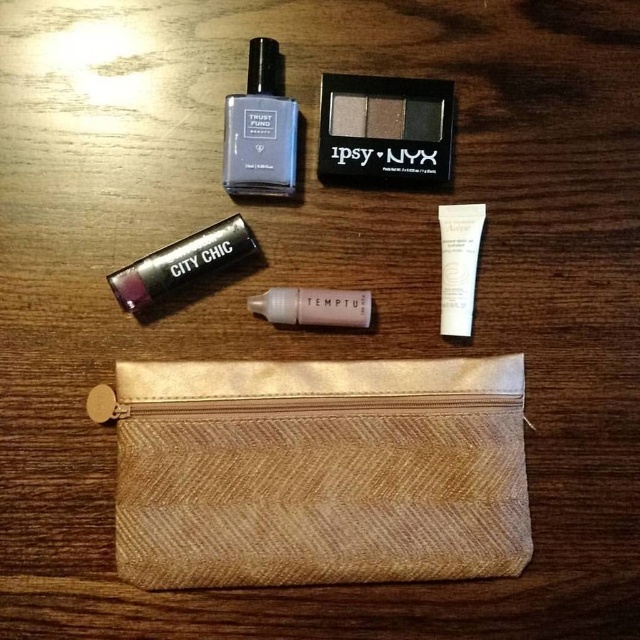
Is gold textured pouch at center smaller than matte eyeshadow palette at upper center?

Incorrect, gold textured pouch at center is not smaller in size than matte eyeshadow palette at upper center.

Measure the distance between gold textured pouch at center and matte eyeshadow palette at upper center.

14.85 inches

Does point (316, 461) come farther from viewer compared to point (317, 170)?

No, it is in front of (317, 170).

The width and height of the screenshot is (640, 640). In order to click on gold textured pouch at center in this screenshot , I will do `click(317, 470)`.

Which of these two, matte eyeshadow palette at upper center or white matte tube at upper right, stands shorter?

With less height is matte eyeshadow palette at upper center.

Between matte eyeshadow palette at upper center and white matte tube at upper right, which one appears on the right side from the viewer's perspective?

Positioned to the right is white matte tube at upper right.

Which is behind, point (381, 104) or point (448, 269)?

Positioned behind is point (448, 269).

The image size is (640, 640). I want to click on matte eyeshadow palette at upper center, so click(x=385, y=129).

Describe the element at coordinates (385, 129) in the screenshot. I see `matte eyeshadow palette at upper center` at that location.

Which of these two, matte eyeshadow palette at upper center or satin pink liquid at center, stands shorter?

Standing shorter between the two is satin pink liquid at center.

Based on the photo, who is more distant from viewer, (x=330, y=129) or (x=282, y=321)?

The point (x=330, y=129) is behind.

Find the location of a particular element. The height and width of the screenshot is (640, 640). matte eyeshadow palette at upper center is located at coordinates (385, 129).